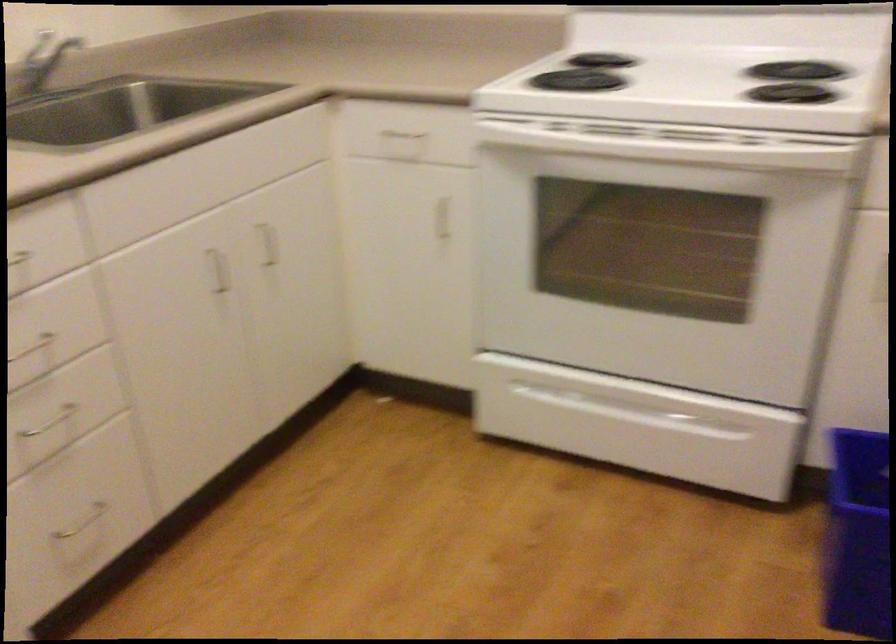
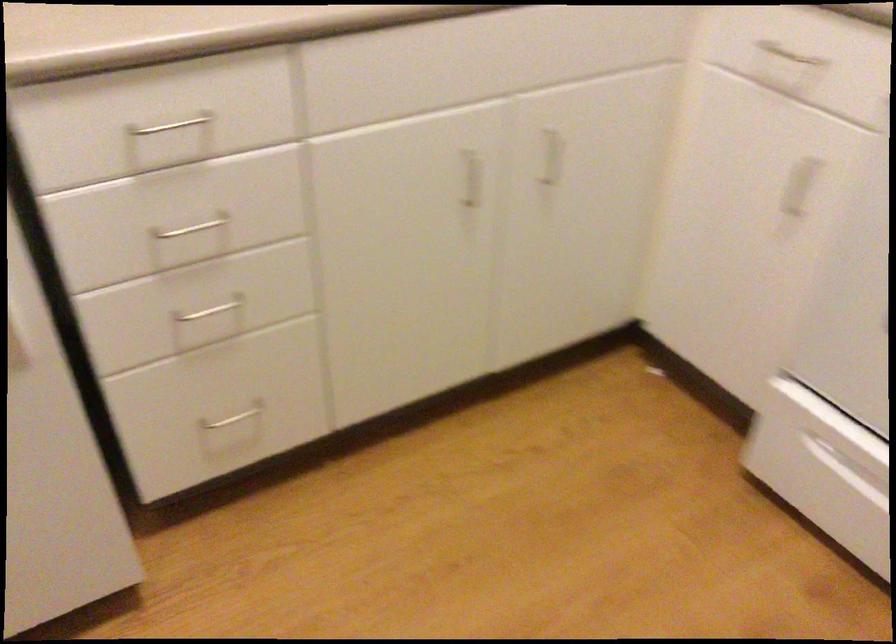
Locate, in the second image, the point that corresponds to [264,245] in the first image.

(552, 156)